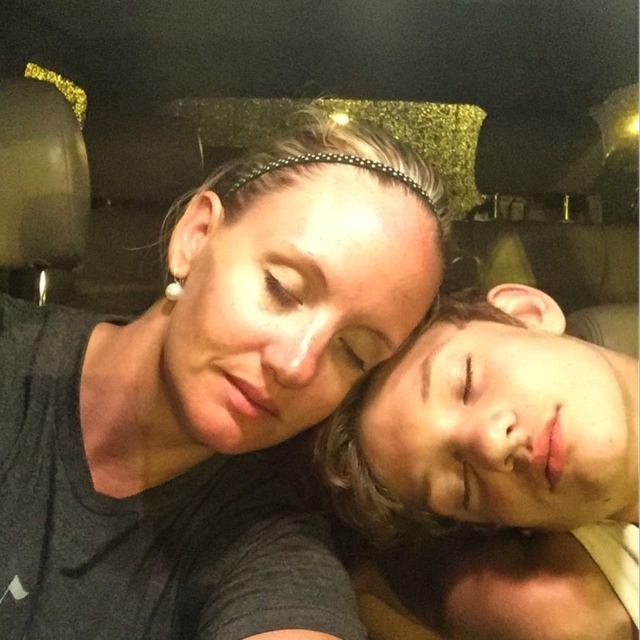
You are a photographer adjusting the lighting in the scene. You need to ensure that the matte black hair at center is properly illuminated. Which object from the scene must you focus on to achieve this?

The matte black hair at center is located at point (202, 416), so you should focus the lighting on the matte black hair at center to ensure it is properly illuminated.

In the scene shown: You are a photographer trying to capture a closeup of the smooth skin face at right without the matte black hair at center blocking it. Based on their positions, is this possible?

The matte black hair at center is in front of the smooth skin face at right, so it would block the view. To capture the smooth skin face at right clearly, you need to adjust the angle or move the subjects so the matte black hair at center is no longer in front.